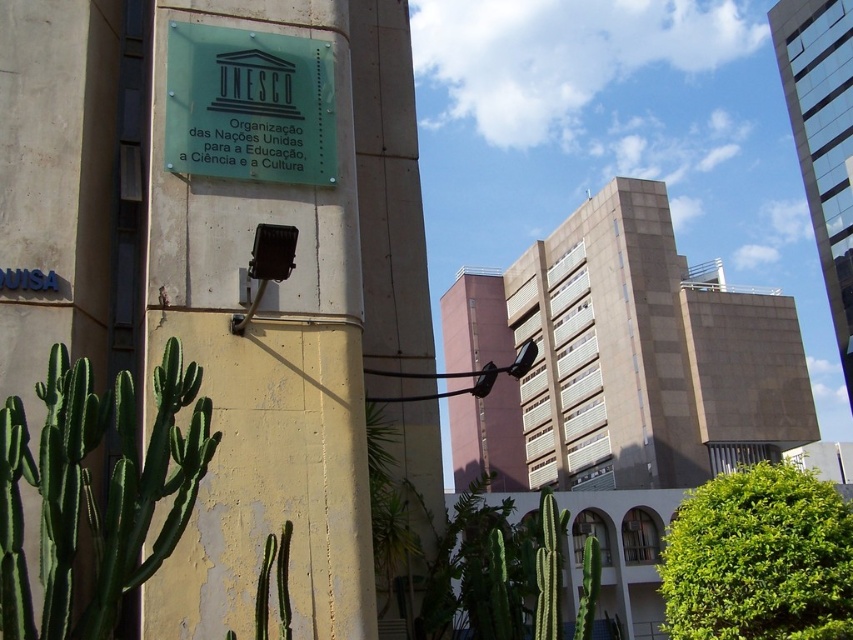
You are a delivery person trying to navigate through the area. You need to place a package near the green spiky cactus at lower left without blocking the transparent glass sign at upper center. Based on their positions, which object should you approach first from the front of the building?

You should approach the green spiky cactus at lower left first because it is positioned to the left of the transparent glass sign at upper center, meaning it is closer to the front of the building.

You are a city planner assessing the layout of this urban space. Considering the green spiky cactus at lower left and the transparent glass sign at upper center, which object occupies a greater vertical space in the image?

The green spiky cactus at lower left is taller than the transparent glass sign at upper center, so it occupies more vertical space in the image.